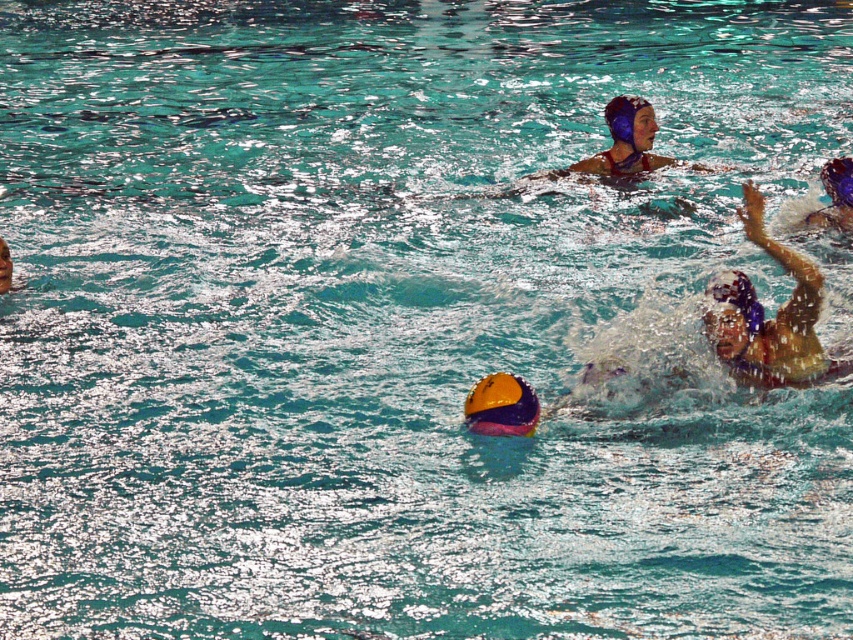
Does matte blue swim cap at upper center lie behind yellow matte swim cap at center?

Yes, matte blue swim cap at upper center is further from the viewer.

Is point (604, 115) positioned after point (494, 387)?

Yes, point (604, 115) is behind point (494, 387).

At what (x,y) coordinates should I click in order to perform the action: click on matte blue swim cap at upper center. Please return your answer as a coordinate pair (x, y). Looking at the image, I should click on (625, 140).

Who is higher up, matte blue swim cap at upper center or blue glossy swim cap at upper right?

Positioned higher is matte blue swim cap at upper center.

Is point (666, 157) in front of point (846, 209)?

That is False.

Locate an element on the screen. This screenshot has width=853, height=640. matte blue swim cap at upper center is located at coordinates (625, 140).

Between point (730, 326) and point (628, 173), which one is positioned in front?

Positioned in front is point (730, 326).

Is yellow and purple helmet at lower right bigger than matte blue swim cap at upper center?

Actually, yellow and purple helmet at lower right might be smaller than matte blue swim cap at upper center.

Which is behind, point (781, 342) or point (636, 173)?

The point (636, 173) is behind.

The height and width of the screenshot is (640, 853). What are the coordinates of `yellow and purple helmet at lower right` in the screenshot? It's located at (769, 320).